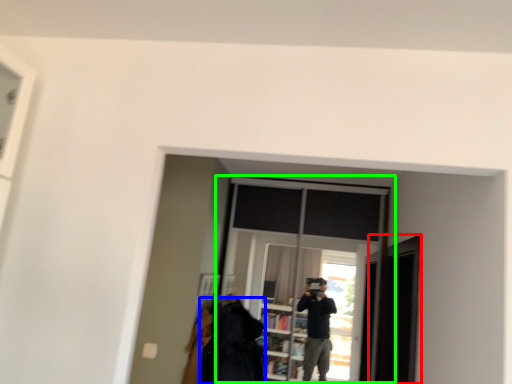
Question: Which object is positioned farthest from screen door (highlighted by a red box)? Select from clothing (highlighted by a blue box) and window (highlighted by a green box).

Choices:
 (A) clothing
 (B) window

Answer: (A)